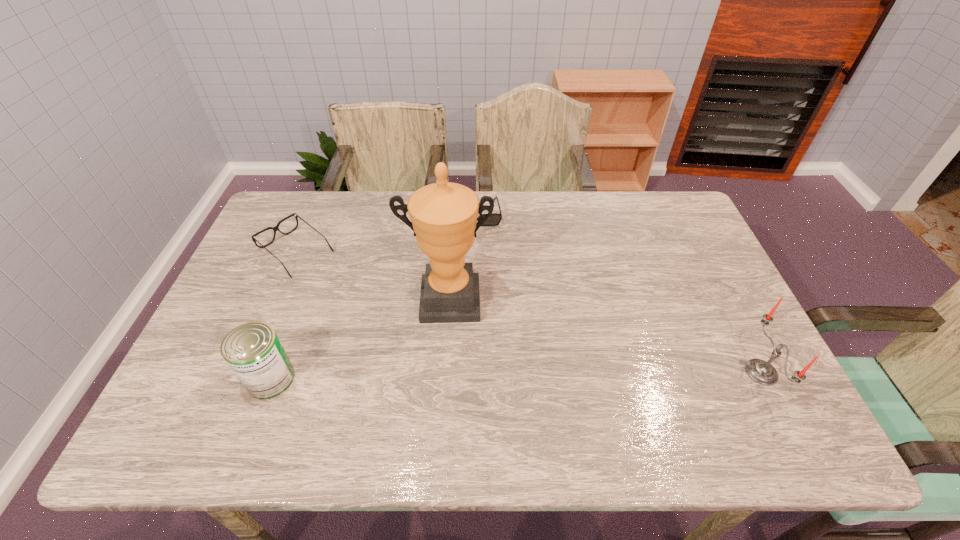
Find the location of a particular element. The width and height of the screenshot is (960, 540). free space on the desktop that is between the third tallest object and the second tallest object and is positioned on the front-facing side of the sunglasses is located at coordinates (495, 375).

The width and height of the screenshot is (960, 540). Identify the location of free space on the desktop that is between the third shortest object and the second tallest object and is positioned with the lenses facing outward on the spectacles. (457, 376).

Where is `vacant spot on the desktop that is between the can and the second tallest object and is positioned at the front of the tallest object with handles`? This screenshot has width=960, height=540. vacant spot on the desktop that is between the can and the second tallest object and is positioned at the front of the tallest object with handles is located at coordinates (447, 376).